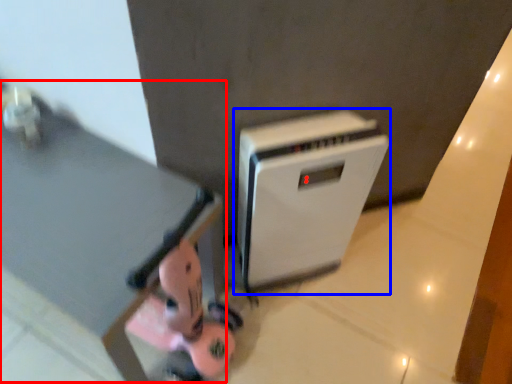
Question: Which of the following is the closest to the observer, table (highlighted by a red box) or home appliance (highlighted by a blue box)?

Choices:
 (A) table
 (B) home appliance

Answer: (A)